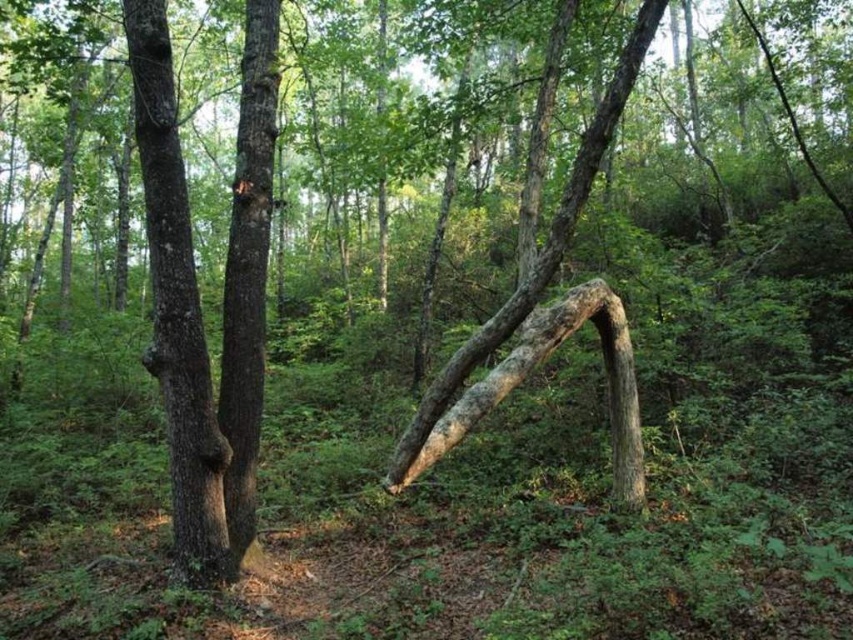
Can you confirm if brown rough bark tree trunk at left is smaller than smooth brown tree trunk at center?

No, brown rough bark tree trunk at left is not smaller than smooth brown tree trunk at center.

Can you confirm if brown rough bark tree trunk at left is thinner than smooth brown tree trunk at center?

Incorrect, brown rough bark tree trunk at left's width is not less than smooth brown tree trunk at center's.

Between point (140, 84) and point (252, 508), which one is positioned in front?

Point (140, 84)

The height and width of the screenshot is (640, 853). I want to click on brown rough bark tree trunk at left, so click(177, 310).